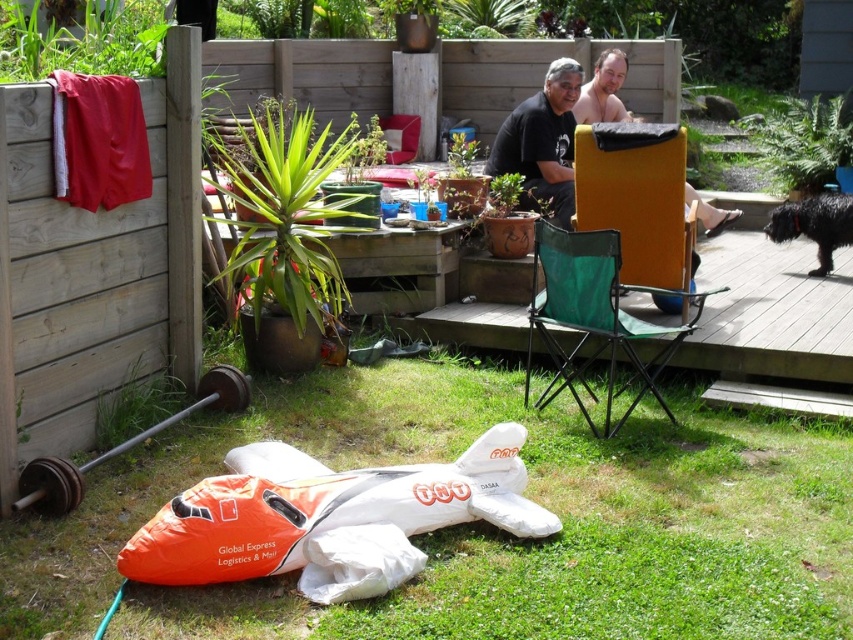
Question: Which point appears closest to the camera in this image?

Choices:
 (A) (263, 449)
 (B) (534, 244)

Answer: (A)

Question: Can you confirm if green grass at lower center is smaller than wooden deck at center?

Choices:
 (A) yes
 (B) no

Answer: (A)

Question: Among these objects, which one is nearest to the camera?

Choices:
 (A) green mesh chair at center
 (B) wooden deck at center

Answer: (A)

Question: Is orange fabric airplane at lower center to the right of green mesh chair at center from the viewer's perspective?

Choices:
 (A) yes
 (B) no

Answer: (B)

Question: Which of the following is the closest to the observer?

Choices:
 (A) yellow fabric chair at upper right
 (B) orange fabric airplane at lower center

Answer: (B)

Question: Is green grass at lower center positioned in front of yellow fabric chair at upper right?

Choices:
 (A) yes
 (B) no

Answer: (A)